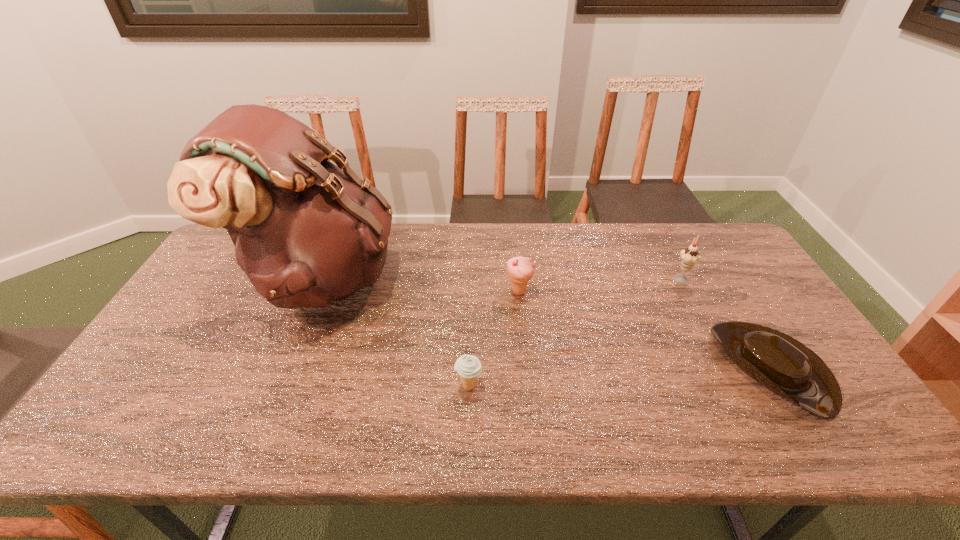
At what (x,y) coordinates should I click in order to perform the action: click on vacant space at the left edge of the desktop. Please return your answer as a coordinate pair (x, y). Looking at the image, I should click on (174, 406).

The image size is (960, 540). In the image, there is a desktop. Find the location of `vacant space at the right edge`. vacant space at the right edge is located at coordinates (731, 308).

The height and width of the screenshot is (540, 960). In order to click on vacant region at the far right corner of the desktop in this screenshot , I will do `click(699, 254)`.

Where is `vacant area between the fourth object from right to left and the tallest object`? This screenshot has width=960, height=540. vacant area between the fourth object from right to left and the tallest object is located at coordinates (396, 331).

You are a GUI agent. You are given a task and a screenshot of the screen. Output one action in this format:
    pyautogui.click(x=<x>, y=<y>)
    Task: Click on the vacant area that lies between the tallest object and the third object from left to right
    This screenshot has height=540, width=960.
    Given the screenshot: What is the action you would take?
    pyautogui.click(x=420, y=284)

You are a GUI agent. You are given a task and a screenshot of the screen. Output one action in this format:
    pyautogui.click(x=<x>, y=<y>)
    Task: Click on the vacant area that lies between the third object from left to right and the fourth tallest object
    This screenshot has height=540, width=960.
    Given the screenshot: What is the action you would take?
    pyautogui.click(x=493, y=339)

I want to click on free space between the rightmost icecream and the leftmost object, so click(x=502, y=278).

Image resolution: width=960 pixels, height=540 pixels. I want to click on unoccupied position between the rightmost icecream and the fourth object from right to left, so click(x=574, y=332).

At what (x,y) coordinates should I click in order to perform the action: click on vacant area that lies between the tallest object and the rightmost icecream. Please return your answer as a coordinate pair (x, y). Looking at the image, I should click on pos(502,278).

You are a GUI agent. You are given a task and a screenshot of the screen. Output one action in this format:
    pyautogui.click(x=<x>, y=<y>)
    Task: Click on the vacant point located between the rightmost icecream and the third object from left to right
    This screenshot has height=540, width=960.
    Given the screenshot: What is the action you would take?
    pyautogui.click(x=599, y=285)